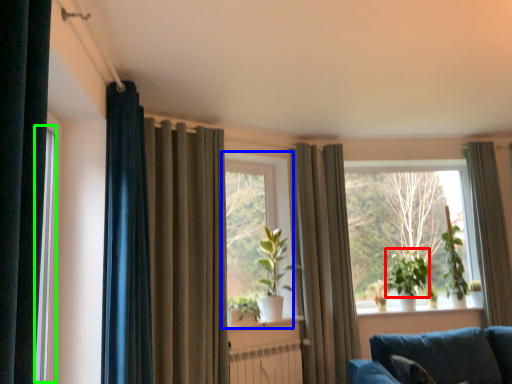
Question: Considering the real-world distances, which object is farthest from plant (highlighted by a red box)? window (highlighted by a blue box) or window frame (highlighted by a green box)?

Choices:
 (A) window
 (B) window frame

Answer: (B)